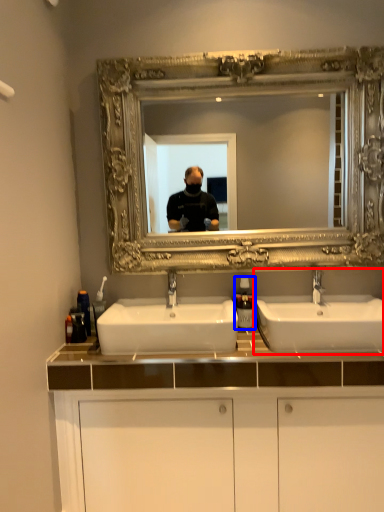
Question: Among these objects, which one is farthest to the camera, sink (highlighted by a red box) or soap dispenser (highlighted by a blue box)?

Choices:
 (A) sink
 (B) soap dispenser

Answer: (B)